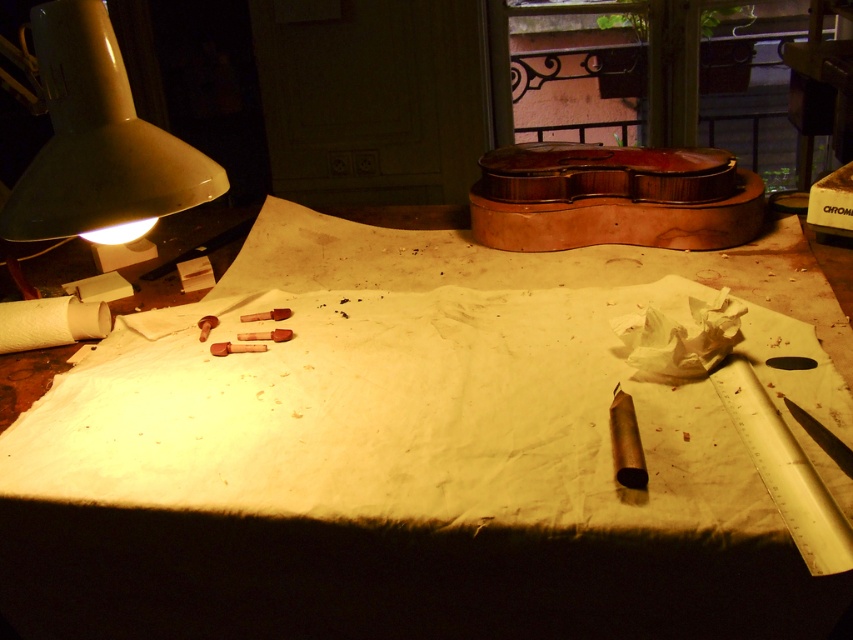
Question: Can you confirm if matte white lamp at upper left is bigger than shiny varnished violin at upper center?

Choices:
 (A) yes
 (B) no

Answer: (B)

Question: Does white paper at center appear under shiny varnished violin at upper center?

Choices:
 (A) yes
 (B) no

Answer: (A)

Question: Estimate the real-world distances between objects in this image. Which object is closer to the matte white lamp at upper left?

Choices:
 (A) shiny varnished violin at upper center
 (B) white paper towel at lower left
 (C) white paper at center

Answer: (B)

Question: Is white paper at center further to the viewer compared to shiny varnished violin at upper center?

Choices:
 (A) yes
 (B) no

Answer: (B)

Question: Which object is farther from the camera taking this photo?

Choices:
 (A) matte white lamp at upper left
 (B) white paper at center
 (C) shiny varnished violin at upper center

Answer: (C)

Question: Which of the following is the farthest from the observer?

Choices:
 (A) (625, 163)
 (B) (45, 145)
 (C) (44, 308)
 (D) (527, 467)

Answer: (A)